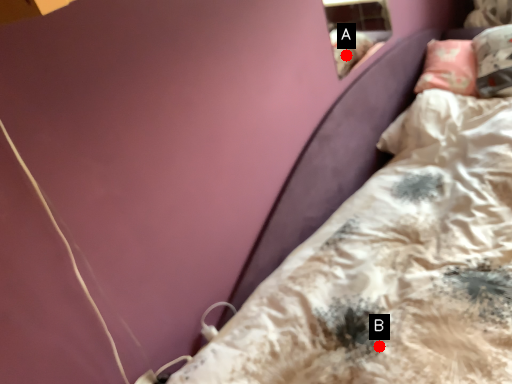
Question: Two points are circled on the image, labeled by A and B beside each circle. Which point is closer to the camera?

Choices:
 (A) A is closer
 (B) B is closer

Answer: (B)